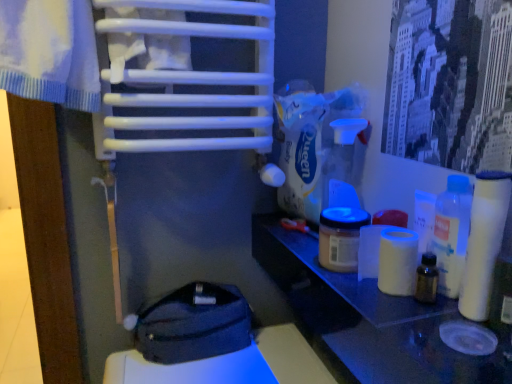
Question: Can you confirm if dark gray fabric pouch at lower center is bigger than white matte toilet paper at right, marked as the first toilet paper in a front-to-back arrangement?

Choices:
 (A) no
 (B) yes

Answer: (B)

Question: Is dark gray fabric pouch at lower center facing away from white matte toilet paper at right, which ranks as the 1th toilet paper in right-to-left order?

Choices:
 (A) no
 (B) yes

Answer: (A)

Question: Is dark gray fabric pouch at lower center outside of white matte toilet paper at right, which ranks as the 2th toilet paper in left-to-right order?

Choices:
 (A) yes
 (B) no

Answer: (A)

Question: Does dark gray fabric pouch at lower center appear on the right side of white matte toilet paper at right, which ranks as the 1th toilet paper in right-to-left order?

Choices:
 (A) yes
 (B) no

Answer: (B)

Question: Does dark gray fabric pouch at lower center come in front of white matte toilet paper at right, marked as the first toilet paper in a front-to-back arrangement?

Choices:
 (A) yes
 (B) no

Answer: (B)

Question: Is white matte toilet paper at right, marked as the first toilet paper in a front-to-back arrangement, to the left or to the right of white matte toilet paper at right, marked as the second toilet paper in a front-to-back arrangement, in the image?

Choices:
 (A) left
 (B) right

Answer: (B)

Question: From a real-world perspective, is white matte toilet paper at right, which ranks as the 2th toilet paper in left-to-right order, positioned above or below white matte toilet paper at right, which appears as the 1th toilet paper when viewed from the left?

Choices:
 (A) above
 (B) below

Answer: (A)

Question: Would you say white matte toilet paper at right, which ranks as the 1th toilet paper in right-to-left order, is inside or outside white matte toilet paper at right, which ranks as the 2th toilet paper in right-to-left order?

Choices:
 (A) inside
 (B) outside

Answer: (B)

Question: Is point (489, 203) closer or farther from the camera than point (408, 266)?

Choices:
 (A) farther
 (B) closer

Answer: (B)

Question: In the image, is dark gray fabric pouch at lower center on the left side or the right side of translucent plastic bottle at right?

Choices:
 (A) left
 (B) right

Answer: (A)

Question: Considering the positions of dark gray fabric pouch at lower center and translucent plastic bottle at right in the image, is dark gray fabric pouch at lower center taller or shorter than translucent plastic bottle at right?

Choices:
 (A) short
 (B) tall

Answer: (A)

Question: Looking at their shapes, would you say dark gray fabric pouch at lower center is wider or thinner than translucent plastic bottle at right?

Choices:
 (A) thin
 (B) wide

Answer: (B)

Question: Considering the positions of dark gray fabric pouch at lower center and translucent plastic bottle at right in the image, is dark gray fabric pouch at lower center bigger or smaller than translucent plastic bottle at right?

Choices:
 (A) small
 (B) big

Answer: (B)

Question: Relative to translucent plastic bottle at right, is white glossy table at right in front or behind?

Choices:
 (A) behind
 (B) front

Answer: (B)

Question: Would you say white glossy table at right is to the left or to the right of translucent plastic bottle at right in the picture?

Choices:
 (A) left
 (B) right

Answer: (A)